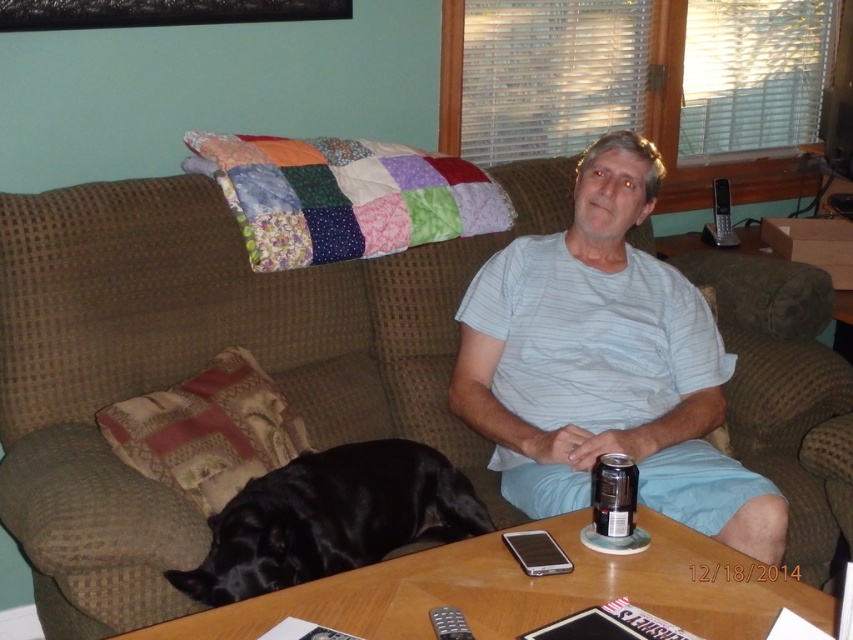
Does light blue striped shirt at center appear under black smooth dog at lower left?

Actually, light blue striped shirt at center is above black smooth dog at lower left.

Does light blue striped shirt at center appear on the left side of black smooth dog at lower left?

Incorrect, light blue striped shirt at center is not on the left side of black smooth dog at lower left.

Identify the location of light blue striped shirt at center. (606, 365).

Is point (614, 493) closer to camera compared to point (445, 634)?

No.

Is dark matte can at center positioned before black plastic remote at lower center?

No, dark matte can at center is further to the viewer.

Between point (618, 516) and point (434, 614), which one is positioned behind?

The point (618, 516) is behind.

I want to click on dark matte can at center, so click(x=613, y=493).

Consider the image. Does black smooth dog at lower left appear over dark matte can at center?

Actually, black smooth dog at lower left is below dark matte can at center.

Who is positioned more to the right, black smooth dog at lower left or dark matte can at center?

From the viewer's perspective, dark matte can at center appears more on the right side.

Where is `black smooth dog at lower left`? The height and width of the screenshot is (640, 853). black smooth dog at lower left is located at coordinates pos(331,518).

Where is `black smooth dog at lower left`? The height and width of the screenshot is (640, 853). black smooth dog at lower left is located at coordinates (331, 518).